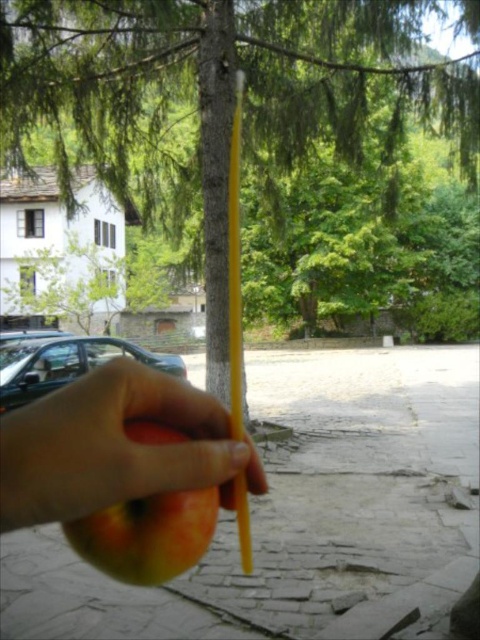
Does green textured tree at center appear over smooth orange at center?

Indeed, green textured tree at center is positioned over smooth orange at center.

Between green textured tree at center and smooth orange at center, which one is positioned lower?

smooth orange at center

Who is more distant from viewer, (211, 83) or (164, 452)?

Positioned behind is point (211, 83).

Identify the location of green textured tree at center. (228, 83).

Can you confirm if smooth orange at center is positioned to the left of ripe yellow apple at center?

Correct, you'll find smooth orange at center to the left of ripe yellow apple at center.

What do you see at coordinates (115, 445) in the screenshot? Image resolution: width=480 pixels, height=640 pixels. I see `smooth orange at center` at bounding box center [115, 445].

Where is `smooth orange at center`? The image size is (480, 640). smooth orange at center is located at coordinates (115, 445).

Is green textured tree at center further to the viewer compared to ripe yellow apple at center?

Yes, it is behind ripe yellow apple at center.

Measure the distance between green textured tree at center and camera.

green textured tree at center is 11.17 meters away from camera.

Describe the element at coordinates (228, 83) in the screenshot. The height and width of the screenshot is (640, 480). I see `green textured tree at center` at that location.

This screenshot has width=480, height=640. In order to click on green textured tree at center in this screenshot , I will do `click(228, 83)`.